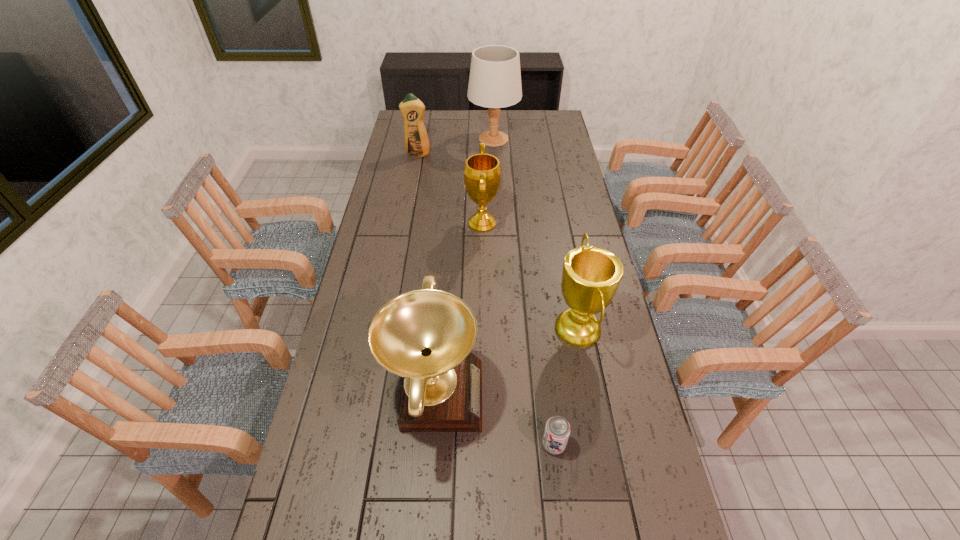
Locate an element on the screen. The width and height of the screenshot is (960, 540). vacant space in between the rightmost object and the third farthest object is located at coordinates (530, 276).

Where is `vacant area that lies between the rightmost award and the beer can`? This screenshot has width=960, height=540. vacant area that lies between the rightmost award and the beer can is located at coordinates (565, 387).

Find the location of a particular element. The image size is (960, 540). vacant point located between the rightmost object and the farthest award is located at coordinates [x=530, y=276].

Locate an element on the screen. free spot between the rightmost award and the table lamp is located at coordinates (536, 234).

At what (x,y) coordinates should I click in order to perform the action: click on vacant area that lies between the shortest object and the detergent. Please return your answer as a coordinate pair (x, y). Looking at the image, I should click on (486, 299).

Image resolution: width=960 pixels, height=540 pixels. In order to click on free spot between the farthest award and the shortest object in this screenshot , I will do `click(518, 334)`.

Choose which object is the second nearest neighbor to the detergent. Please provide its 2D coordinates. Your answer should be formatted as a tuple, i.e. [(x, y)], where the tuple contains the x and y coordinates of a point satisfying the conditions above.

[(482, 172)]

Identify the location of the second closest object to the rightmost award. This screenshot has width=960, height=540. (426, 336).

Locate which award is the closest to the third farthest object. Please provide its 2D coordinates. Your answer should be formatted as a tuple, i.e. [(x, y)], where the tuple contains the x and y coordinates of a point satisfying the conditions above.

[(591, 275)]

Locate an element on the screen. Image resolution: width=960 pixels, height=540 pixels. the closest award to the tallest object is located at coordinates (482, 172).